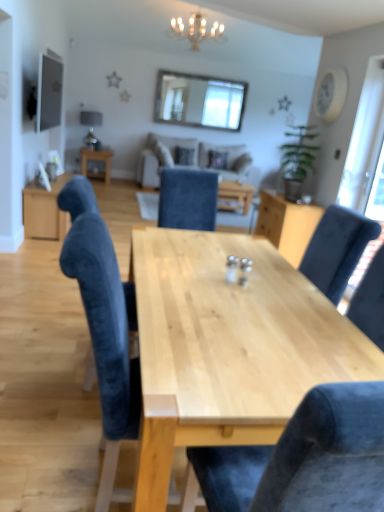
Question: Considering the relative positions of transparent glass door at right, the 2th window screen from the back, and crystal chandelier at upper center in the image provided, is transparent glass door at right, the 2th window screen from the back, to the left of crystal chandelier at upper center from the viewer's perspective?

Choices:
 (A) no
 (B) yes

Answer: (A)

Question: Is transparent glass door at right, which appears as the second window screen when viewed from the left, oriented away from crystal chandelier at upper center?

Choices:
 (A) yes
 (B) no

Answer: (B)

Question: From the image's perspective, does transparent glass door at right, which appears as the 1th window screen when viewed from the front, appear lower than crystal chandelier at upper center?

Choices:
 (A) no
 (B) yes

Answer: (B)

Question: From the image's perspective, is transparent glass door at right, which is the 2th window screen in top-to-bottom order, on crystal chandelier at upper center?

Choices:
 (A) no
 (B) yes

Answer: (A)

Question: From a real-world perspective, is transparent glass door at right, the 2th window screen from the back, physically below crystal chandelier at upper center?

Choices:
 (A) yes
 (B) no

Answer: (A)

Question: Is transparent glass door at right, which is the first window screen from right to left, behind crystal chandelier at upper center?

Choices:
 (A) yes
 (B) no

Answer: (B)

Question: Is natural wood table at center, the 2th table positioned from the left, beside velvet blue chair at center, which is the first chair in front-to-back order?

Choices:
 (A) no
 (B) yes

Answer: (A)

Question: Is natural wood table at center, the 1th table positioned from the front, facing away from velvet blue chair at center, which is the first chair in front-to-back order?

Choices:
 (A) yes
 (B) no

Answer: (A)

Question: Considering the relative sizes of natural wood table at center, the 2th table positioned from the left, and velvet blue chair at center, the second chair when ordered from back to front, in the image provided, is natural wood table at center, the 2th table positioned from the left, wider than velvet blue chair at center, the second chair when ordered from back to front,?

Choices:
 (A) yes
 (B) no

Answer: (A)

Question: Does natural wood table at center, the 2th table positioned from the left, lie in front of velvet blue chair at center, which is the first chair in front-to-back order?

Choices:
 (A) yes
 (B) no

Answer: (A)

Question: From the image's perspective, is natural wood table at center, the 2th table in the back-to-front sequence, on velvet blue chair at center, the second chair when ordered from back to front?

Choices:
 (A) yes
 (B) no

Answer: (B)

Question: From a real-world perspective, is natural wood table at center, which is the first table from right to left, located beneath velvet blue chair at center, the second chair when ordered from back to front?

Choices:
 (A) no
 (B) yes

Answer: (B)

Question: Is velvet blue chair at center, acting as the 2th chair starting from the front, positioned with its back to clear glass window at upper center, the second window screen ordered from the bottom?

Choices:
 (A) no
 (B) yes

Answer: (A)